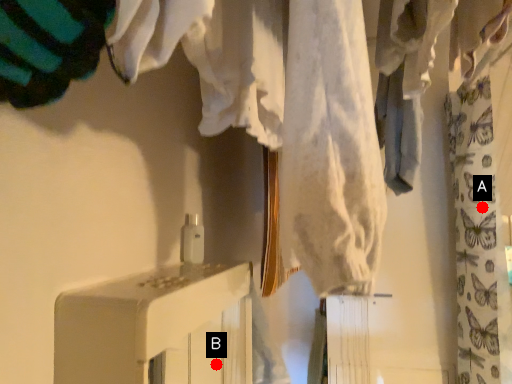
Question: Two points are circled on the image, labeled by A and B beside each circle. Which point is closer to the camera?

Choices:
 (A) A is closer
 (B) B is closer

Answer: (A)